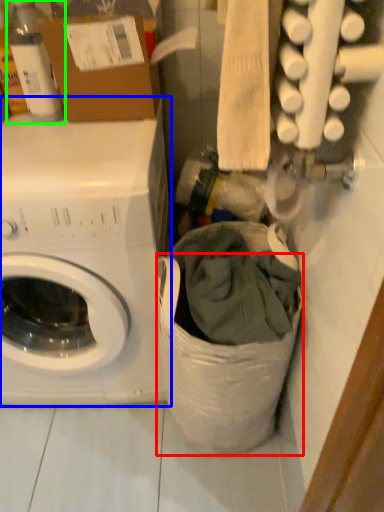
Question: Which object is positioned farthest from laundry basket (highlighted by a red box)? Select from washing machine (highlighted by a blue box) and bottle (highlighted by a green box).

Choices:
 (A) washing machine
 (B) bottle

Answer: (B)